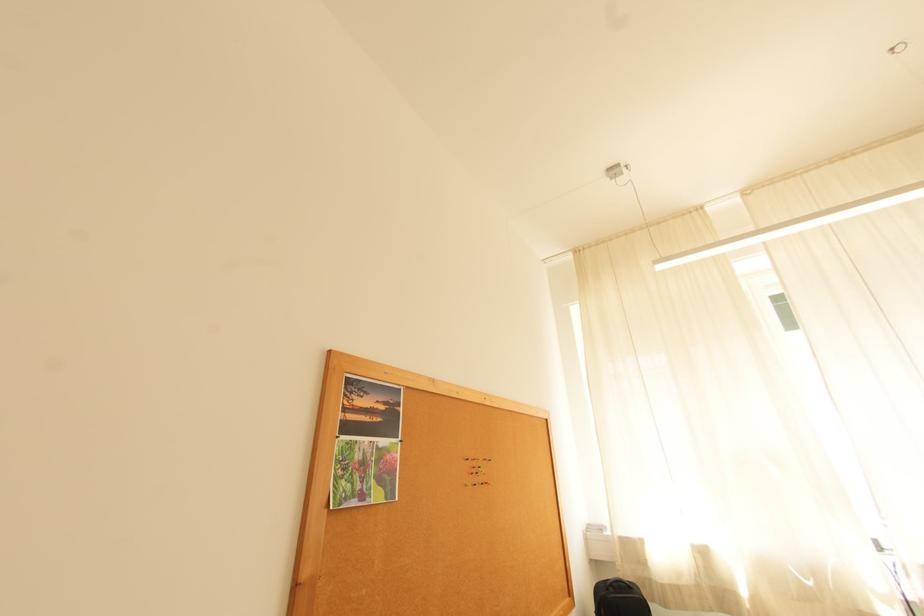
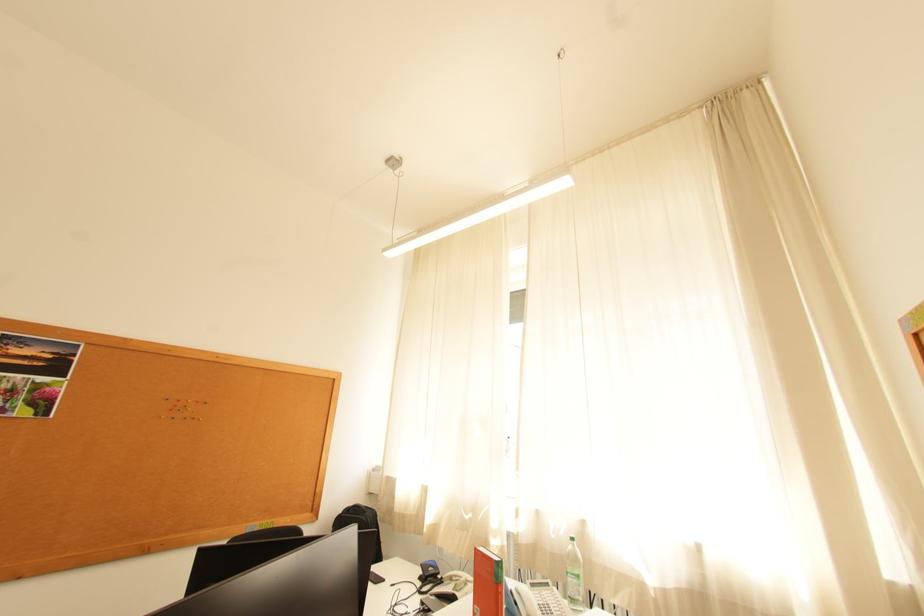
Where in the second image is the point corresponding to the point at 482,472 from the first image?

(186, 408)